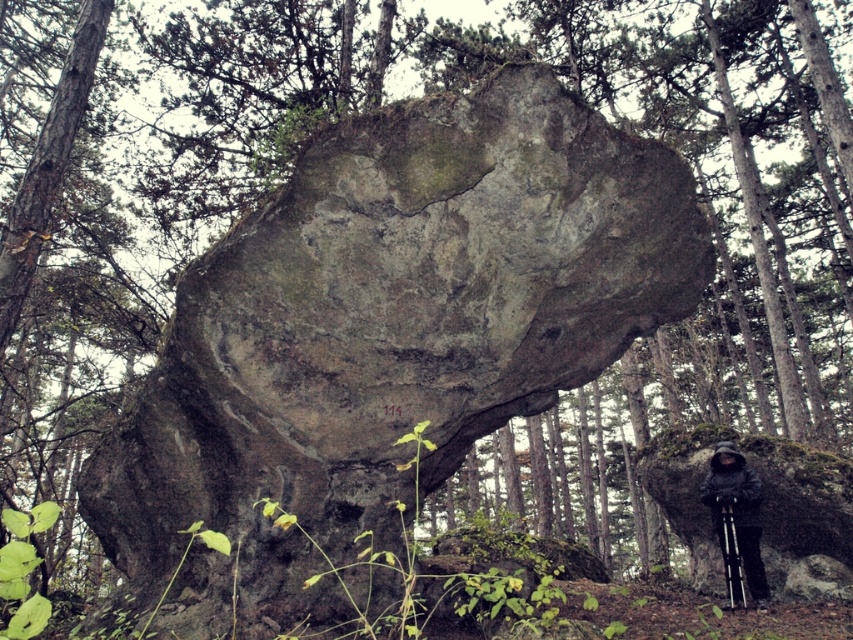
Question: Can you confirm if gray rough rock at center is thinner than dark gray hooded jacket at lower right?

Choices:
 (A) no
 (B) yes

Answer: (A)

Question: Can you confirm if gray rough rock at center is wider than dark gray hooded jacket at lower right?

Choices:
 (A) yes
 (B) no

Answer: (A)

Question: Among these points, which one is nearest to the camera?

Choices:
 (A) (732, 516)
 (B) (447, 413)

Answer: (B)

Question: Which point is closer to the camera taking this photo?

Choices:
 (A) (767, 605)
 (B) (601, 252)

Answer: (B)

Question: Among these points, which one is farthest from the camera?

Choices:
 (A) (740, 500)
 (B) (378, 486)

Answer: (A)

Question: Is gray rough rock at center further to camera compared to dark gray hooded jacket at lower right?

Choices:
 (A) yes
 (B) no

Answer: (B)